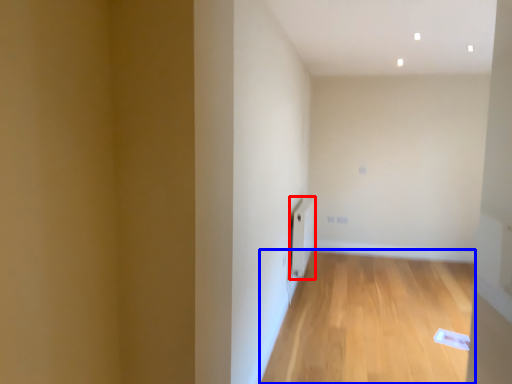
Question: Which object appears closest to the camera in this image, radiator (highlighted by a red box) or corridor (highlighted by a blue box)?

Choices:
 (A) radiator
 (B) corridor

Answer: (B)